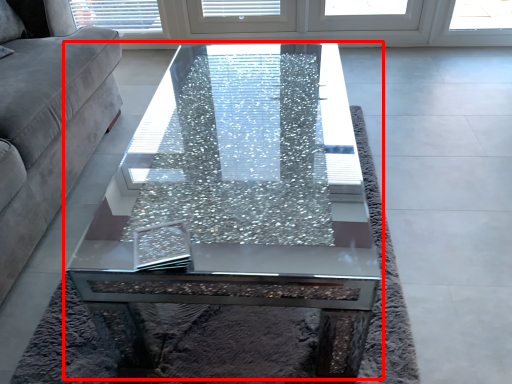
Question: In this image, where is coffee table (annotated by the red box) located relative to studio couch?

Choices:
 (A) left
 (B) right

Answer: (B)